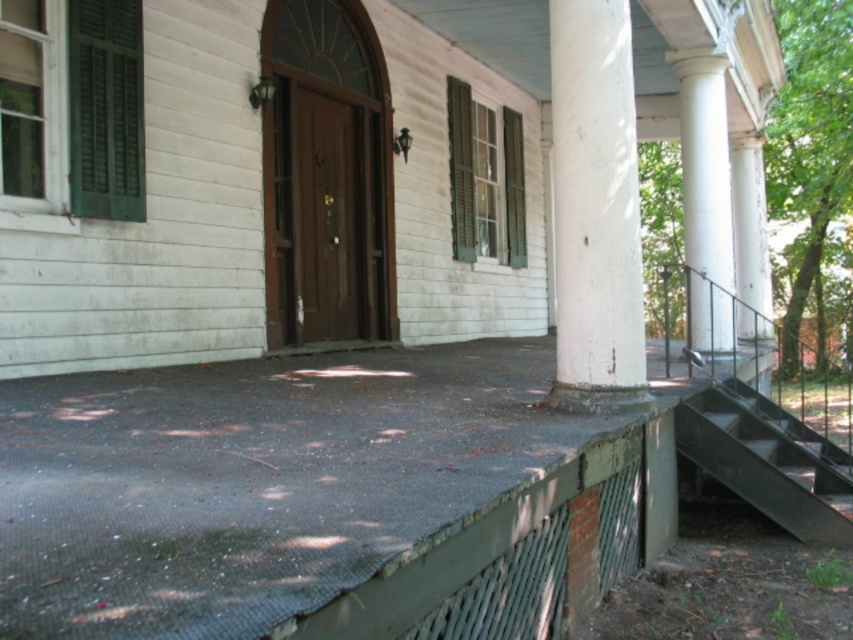
Based on the photo, who is more distant from viewer, (102, 129) or (699, 141)?

The point (699, 141) is more distant.

Can you confirm if green matte shutter at left is wider than white smooth column at right?

No, green matte shutter at left is not wider than white smooth column at right.

The width and height of the screenshot is (853, 640). I want to click on green matte shutter at left, so click(x=105, y=109).

Where is `white smooth column at center`? This screenshot has width=853, height=640. white smooth column at center is located at coordinates (595, 211).

Is white smooth column at center taller than white painted wood column at right?

Incorrect, white smooth column at center's height is not larger of white painted wood column at right's.

Identify the location of white smooth column at center. (595, 211).

Where is `white smooth column at center`? The width and height of the screenshot is (853, 640). white smooth column at center is located at coordinates 595,211.